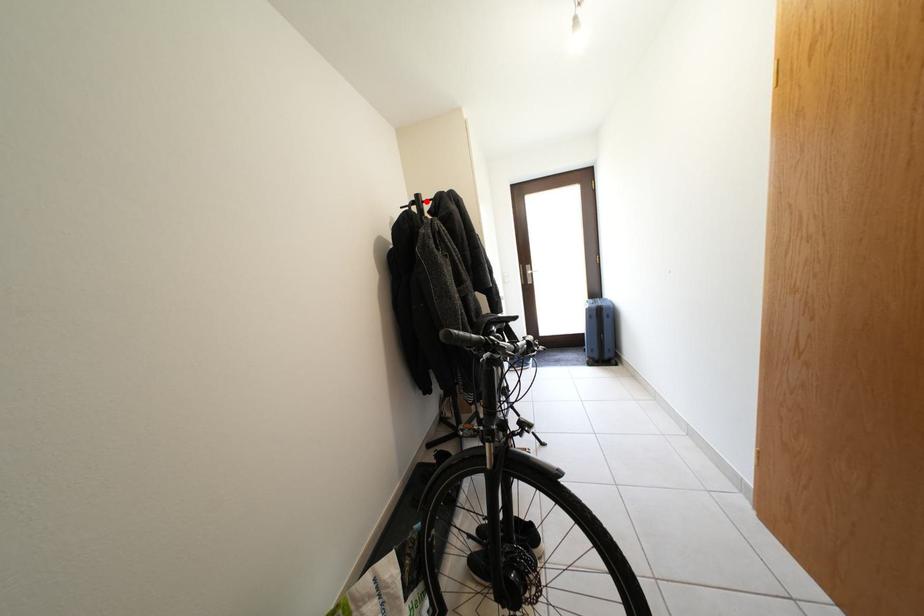
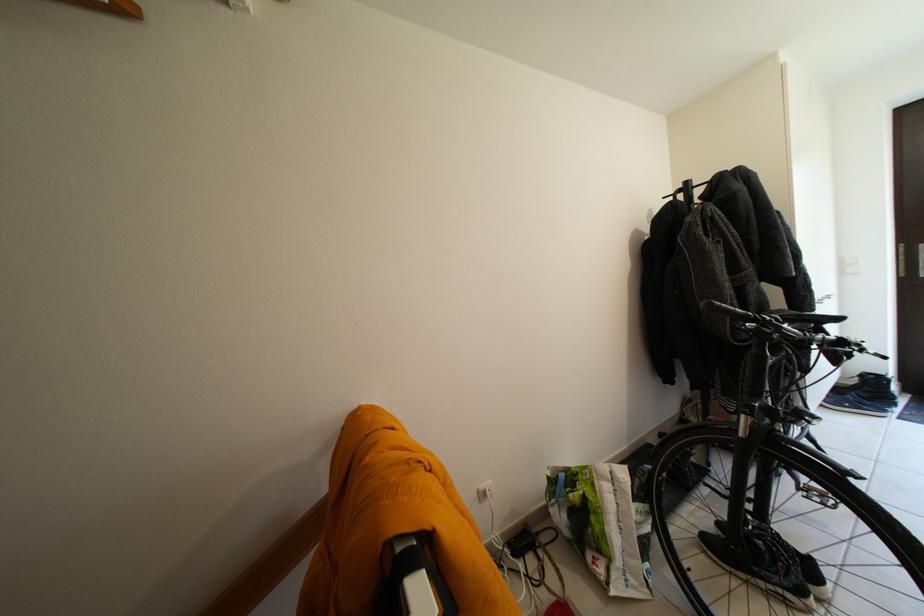
Locate, in the second image, the point that corresponds to the highlighted location in the first image.

(696, 188)